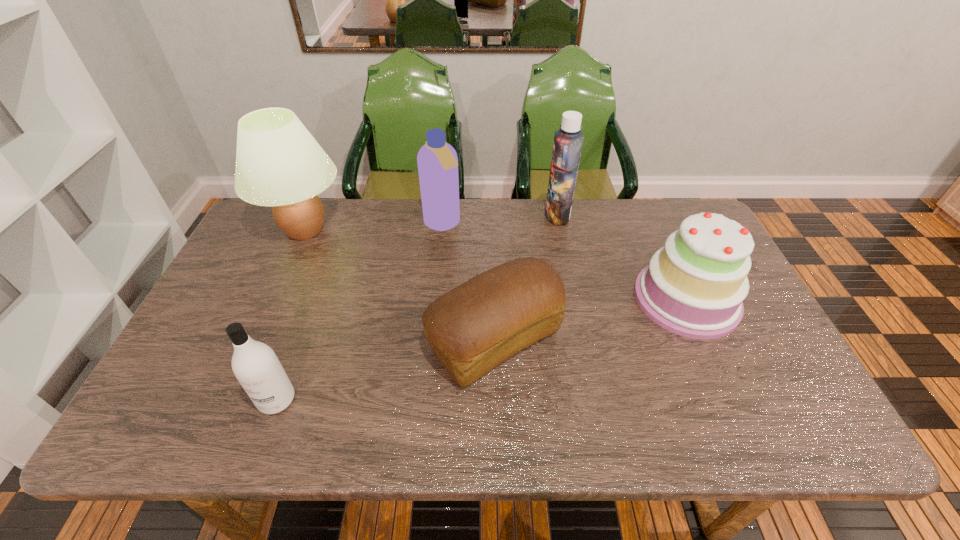
Locate an element on the screen. The height and width of the screenshot is (540, 960). vacant point at the left edge is located at coordinates (171, 396).

Find the location of a particular element. This screenshot has width=960, height=540. blank space at the right edge of the desktop is located at coordinates (747, 308).

Locate an element on the screen. The height and width of the screenshot is (540, 960). vacant area between the lampshade and the shortest shampoo is located at coordinates (291, 315).

Locate an element on the screen. free spot between the second object from right to left and the second shampoo from left to right is located at coordinates [500, 219].

You are a GUI agent. You are given a task and a screenshot of the screen. Output one action in this format:
    pyautogui.click(x=<x>, y=<y>)
    Task: Click on the vacant area that lies between the cake and the rightmost shampoo
    The width and height of the screenshot is (960, 540).
    Given the screenshot: What is the action you would take?
    pyautogui.click(x=622, y=256)

Locate an element on the screen. The width and height of the screenshot is (960, 540). free spot between the shortest object and the lampshade is located at coordinates (400, 285).

You are a GUI agent. You are given a task and a screenshot of the screen. Output one action in this format:
    pyautogui.click(x=<x>, y=<y>)
    Task: Click on the unoccupied area between the cake and the second shampoo from right to left
    
    Given the screenshot: What is the action you would take?
    pyautogui.click(x=564, y=261)

Where is `free space between the cake and the second shampoo from right to left`? This screenshot has width=960, height=540. free space between the cake and the second shampoo from right to left is located at coordinates coord(564,261).

Where is `free spot between the lampshade and the shortest object`? The width and height of the screenshot is (960, 540). free spot between the lampshade and the shortest object is located at coordinates (400, 285).

Locate an element on the screen. The height and width of the screenshot is (540, 960). free point between the second shampoo from left to right and the cake is located at coordinates (564, 261).